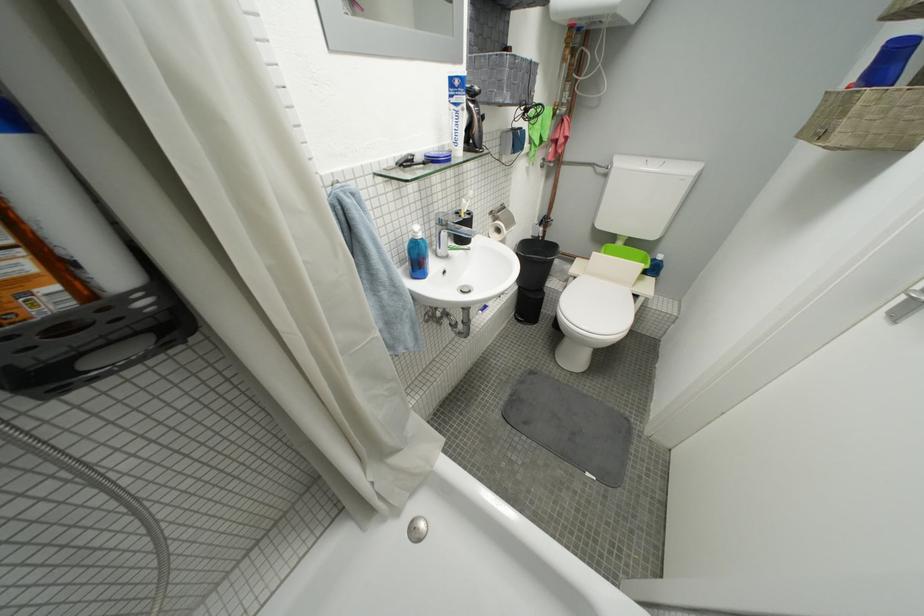
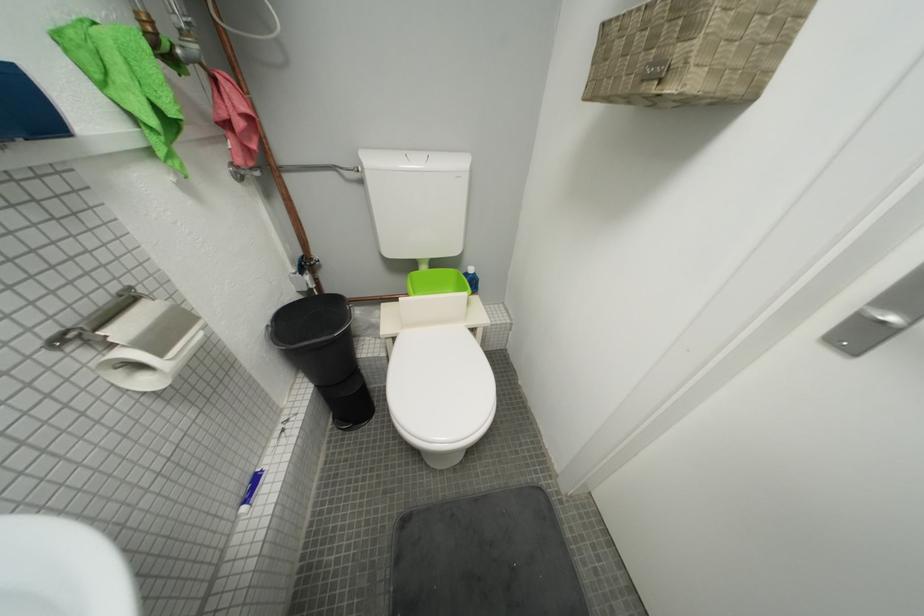
Question: The images are taken continuously from a first-person perspective. In which direction is your viewpoint rotating?

Choices:
 (A) Left
 (B) Right
 (C) Up
 (D) Down

Answer: (B)